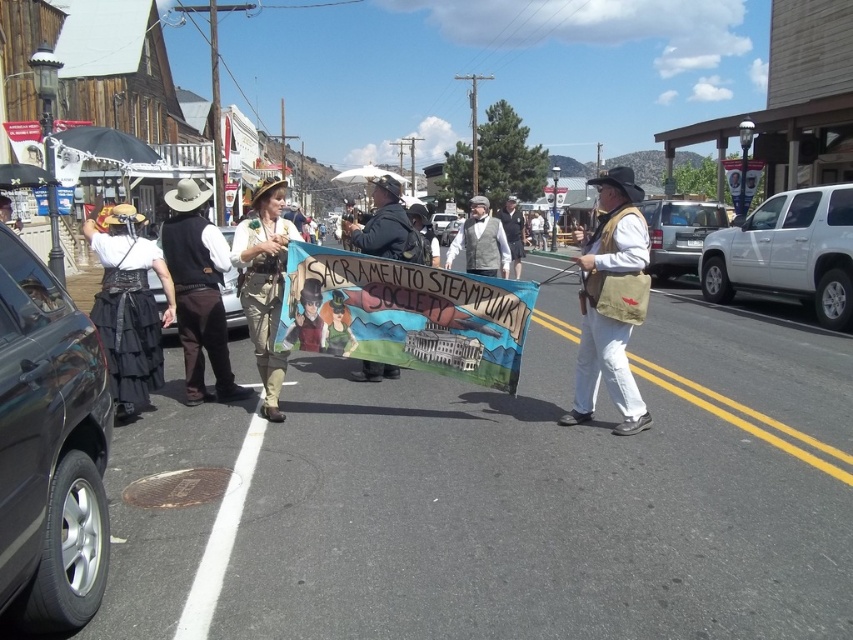
Between brown leather vest at center and matte black sign at center, which one has less height?

brown leather vest at center is shorter.

Between brown leather vest at center and matte black sign at center, which one is positioned higher?

matte black sign at center

Where is `brown leather vest at center`? brown leather vest at center is located at coordinates (198, 291).

Can you confirm if light brown leather bag at center is positioned below light brown leather jacket at center?

Indeed, light brown leather bag at center is positioned under light brown leather jacket at center.

Which is in front, point (614, 275) or point (515, 224)?

Point (614, 275) is in front.

This screenshot has height=640, width=853. Find the location of `light brown leather bag at center`. light brown leather bag at center is located at coordinates (611, 304).

Does matte black sign at center appear on the right side of light brown leather jacket at center?

In fact, matte black sign at center is to the left of light brown leather jacket at center.

Is matte black sign at center taller than light brown leather jacket at center?

No.

Does point (372, 196) come in front of point (500, 216)?

No, it is behind (500, 216).

This screenshot has width=853, height=640. I want to click on matte black sign at center, so click(x=386, y=227).